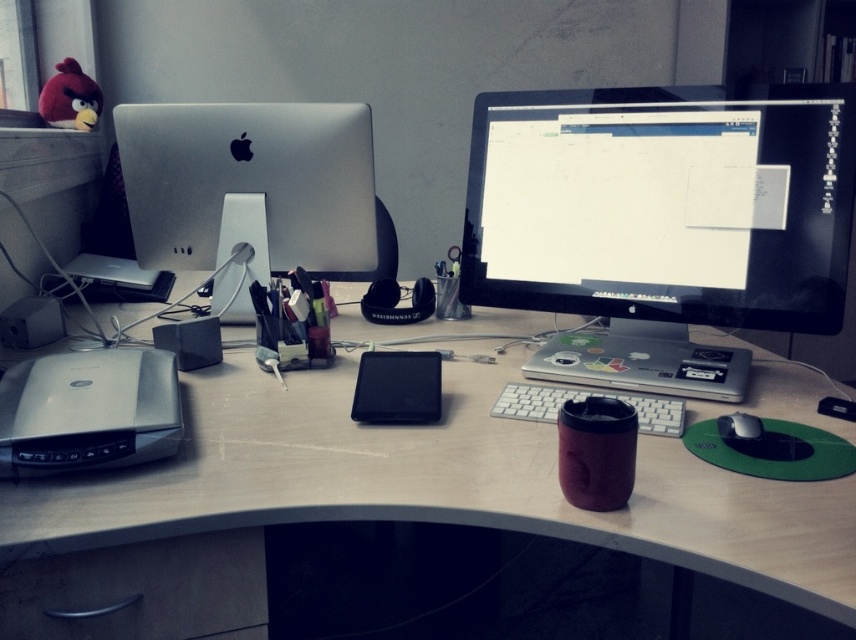
Can you confirm if matte black monitor at center is taller than black matte mouse at center right?

Indeed, matte black monitor at center has a greater height compared to black matte mouse at center right.

Is matte black monitor at center to the left of black matte mouse at center right from the viewer's perspective?

Yes, matte black monitor at center is to the left of black matte mouse at center right.

What are the coordinates of `matte black monitor at center` in the screenshot? It's located at (663, 204).

Is matte black monitor at center to the left of white plastic keyboard at center from the viewer's perspective?

No, matte black monitor at center is not to the left of white plastic keyboard at center.

In order to click on matte black monitor at center in this screenshot , I will do `click(663, 204)`.

Is point (605, 120) more distant than point (254, 193)?

No, it is in front of (254, 193).

In the scene shown: Does matte black monitor at center have a lesser width compared to white plastic speaker at center?

No.

Is point (777, 285) more distant than point (217, 250)?

No, it is not.

Locate an element on the screen. The image size is (856, 640). matte black monitor at center is located at coordinates (663, 204).